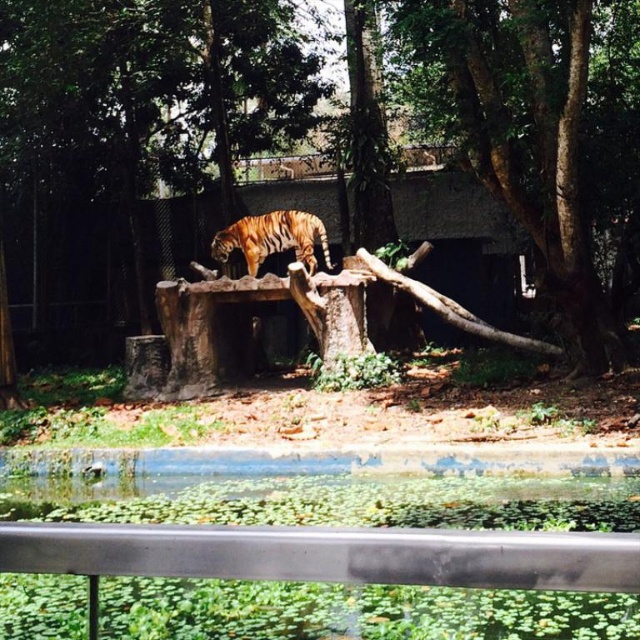
Who is more forward, (557, 173) or (598, 371)?

Point (557, 173)

Between brown rough tree stump at center and brown rough tree trunk at center, which one appears on the left side from the viewer's perspective?

brown rough tree stump at center is more to the left.

This screenshot has width=640, height=640. What are the coordinates of `brown rough tree stump at center` in the screenshot? It's located at (520, 140).

Is silver metallic rail at lower center bigger than orange striped tiger at center?

Incorrect, silver metallic rail at lower center is not larger than orange striped tiger at center.

What do you see at coordinates (328, 554) in the screenshot? I see `silver metallic rail at lower center` at bounding box center [328, 554].

You are a GUI agent. You are given a task and a screenshot of the screen. Output one action in this format:
    pyautogui.click(x=<x>, y=<y>)
    Task: Click on the silver metallic rail at lower center
    This screenshot has width=640, height=640.
    Given the screenshot: What is the action you would take?
    pyautogui.click(x=328, y=554)

Which of these two, brown rough tree stump at center or orange striped tiger at center, stands shorter?

Standing shorter between the two is orange striped tiger at center.

Is brown rough tree stump at center wider than orange striped tiger at center?

Indeed, brown rough tree stump at center has a greater width compared to orange striped tiger at center.

Which is in front, point (611, 296) or point (224, 256)?

Point (224, 256) is more forward.

I want to click on brown rough tree stump at center, so click(520, 140).